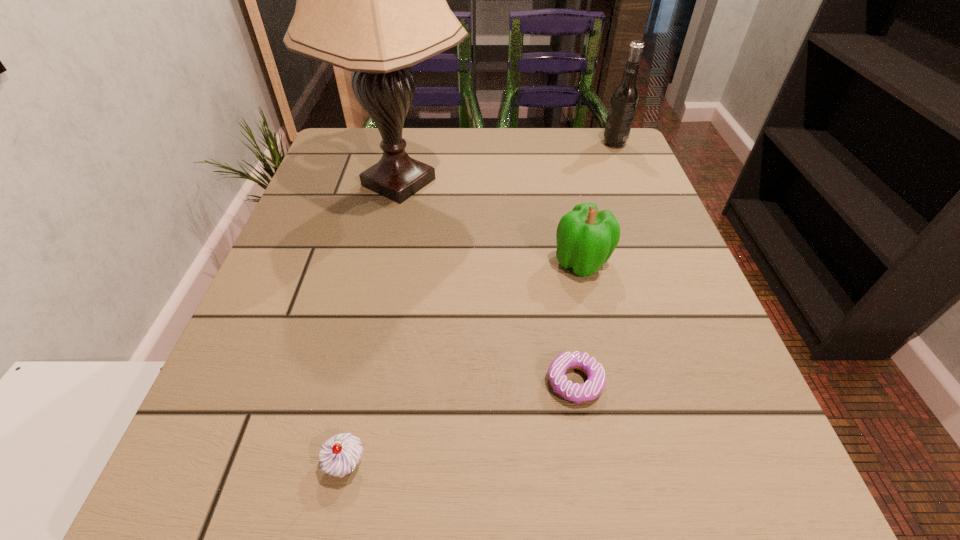
Where is `root beer located in the right edge section of the desktop`? This screenshot has width=960, height=540. root beer located in the right edge section of the desktop is located at coordinates [x=624, y=99].

Where is `bell pepper that is positioned at the right edge`? The image size is (960, 540). bell pepper that is positioned at the right edge is located at coordinates (586, 237).

Find the location of a particular element. object that is positioned at the far left corner is located at coordinates (371, 0).

Where is `object that is at the far right corner`? object that is at the far right corner is located at coordinates (624, 99).

At what (x,y) coordinates should I click in order to perform the action: click on vacant space at the far edge of the desktop. Please return your answer as a coordinate pair (x, y). The image size is (960, 540). Looking at the image, I should click on (531, 161).

Find the location of `free space at the left edge of the desktop`. free space at the left edge of the desktop is located at coordinates (246, 362).

In the image, there is a desktop. Where is `vacant space at the right edge`? The image size is (960, 540). vacant space at the right edge is located at coordinates (647, 202).

Find the location of a particular element. Image resolution: width=960 pixels, height=540 pixels. vacant space at the far left corner of the desktop is located at coordinates pos(366,154).

This screenshot has width=960, height=540. In order to click on vacant space at the near right corner of the desktop in this screenshot , I will do `click(707, 503)`.

Image resolution: width=960 pixels, height=540 pixels. In order to click on empty location between the nearest object and the lamp in this screenshot , I will do `click(372, 323)`.